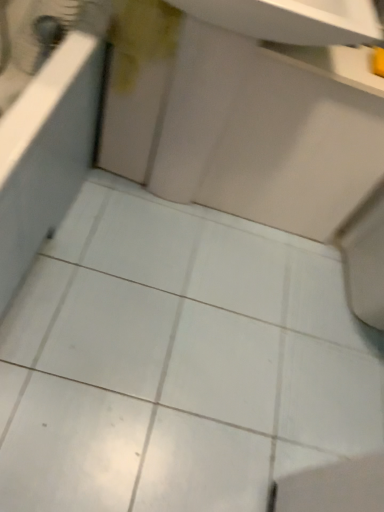
Question: Considering their positions, is white glossy sink at center located in front of or behind white glossy bath at left?

Choices:
 (A) front
 (B) behind

Answer: (B)

Question: From the image's perspective, is white glossy sink at center located above or below white glossy bath at left?

Choices:
 (A) below
 (B) above

Answer: (B)

Question: From a real-world perspective, relative to white glossy bath at left, is white glossy sink at center vertically above or below?

Choices:
 (A) below
 (B) above

Answer: (B)

Question: From a real-world perspective, relative to white glossy sink at center, is white glossy bath at left vertically above or below?

Choices:
 (A) above
 (B) below

Answer: (B)

Question: In terms of width, does white glossy bath at left look wider or thinner when compared to white glossy sink at center?

Choices:
 (A) wide
 (B) thin

Answer: (A)

Question: In the image, is white glossy bath at left on the left side or the right side of white glossy sink at center?

Choices:
 (A) right
 (B) left

Answer: (B)

Question: Considering their positions, is white glossy bath at left located in front of or behind white glossy sink at center?

Choices:
 (A) behind
 (B) front

Answer: (B)